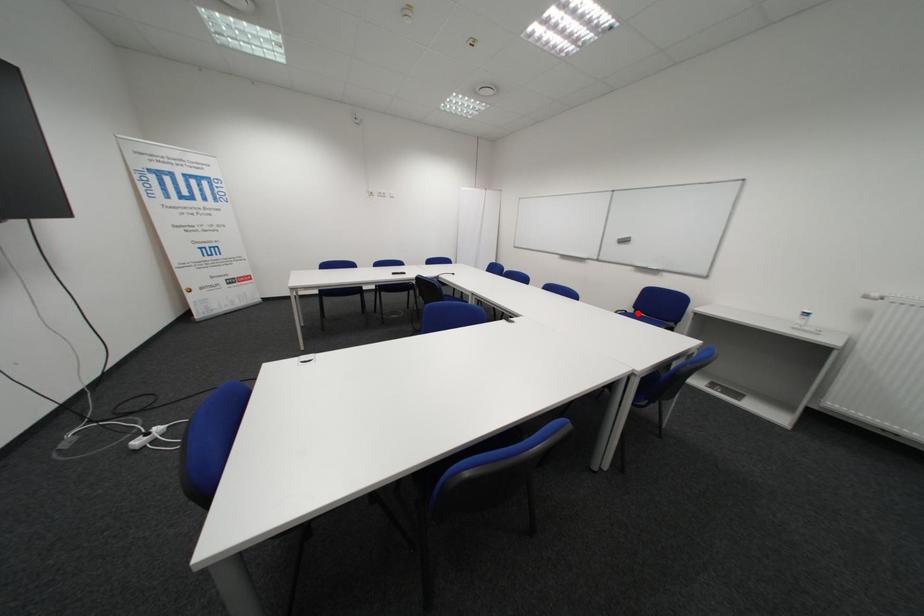
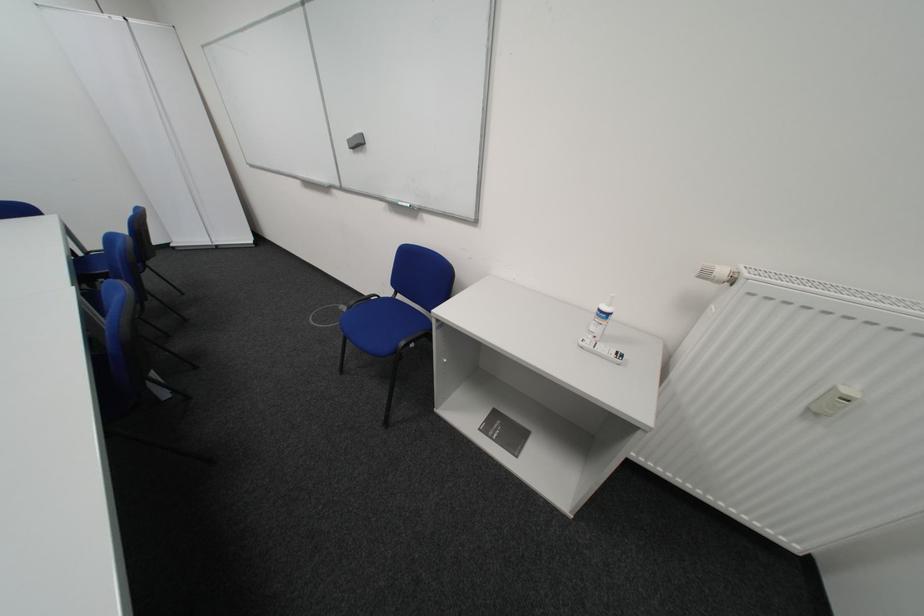
Where in the second image is the point corresponding to the highlighted location from the first image?

(390, 297)